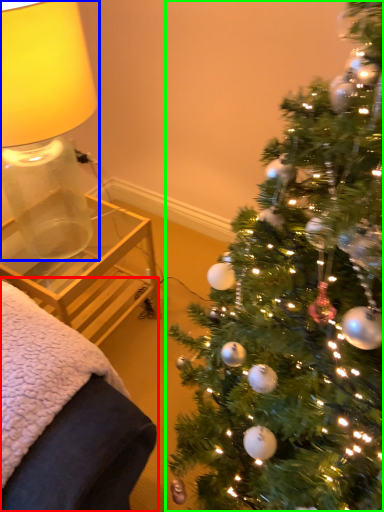
Question: Based on their relative distances, which object is nearer to furniture (highlighted by a red box)? Choose from table lamp (highlighted by a blue box) and christmas tree (highlighted by a green box).

Choices:
 (A) table lamp
 (B) christmas tree

Answer: (B)